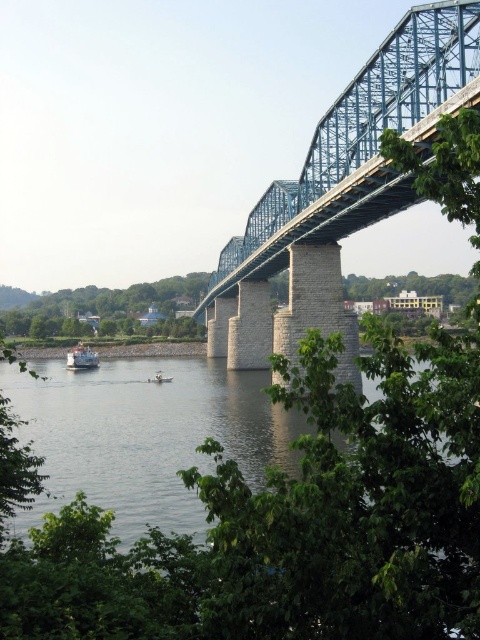
You are standing on the riverbank and want to take a photo of the blue metallic bridge at upper right and the clear water at center. How far apart are these two elements in the scene?

The clear water at center is 26.41 meters away from the blue metallic bridge at upper right, so the distance between them is 26.41 meters.

You are standing at the point with coordinates point (264, 196) and want to walk towards the point with coordinates point (68, 358). According to the scene, will you be moving away from the bridge or towards it?

Point (264, 196) is in front of point (68, 358), so moving towards point (68, 358) means you are moving away from the bridge.